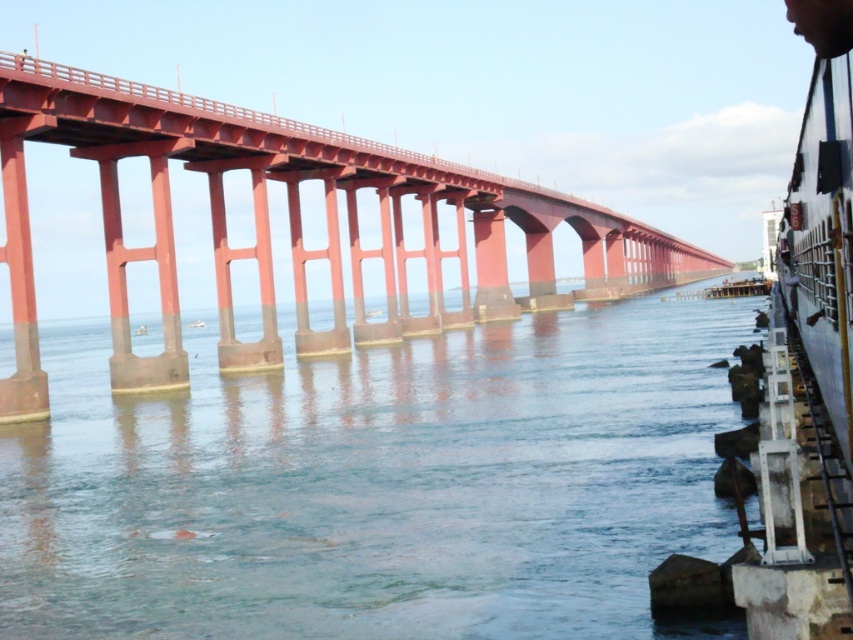
Question: Where is clear water at center located in relation to smooth red bridge at center in the image?

Choices:
 (A) right
 (B) left

Answer: (B)

Question: Does clear water at center lie behind smooth red bridge at center?

Choices:
 (A) yes
 (B) no

Answer: (B)

Question: Which point is farther to the camera?

Choices:
 (A) (120, 269)
 (B) (329, 634)

Answer: (A)

Question: Which of the following is the closest to the observer?

Choices:
 (A) clear water at center
 (B) smooth red bridge at center

Answer: (A)

Question: Can you confirm if clear water at center is wider than smooth red bridge at center?

Choices:
 (A) yes
 (B) no

Answer: (B)